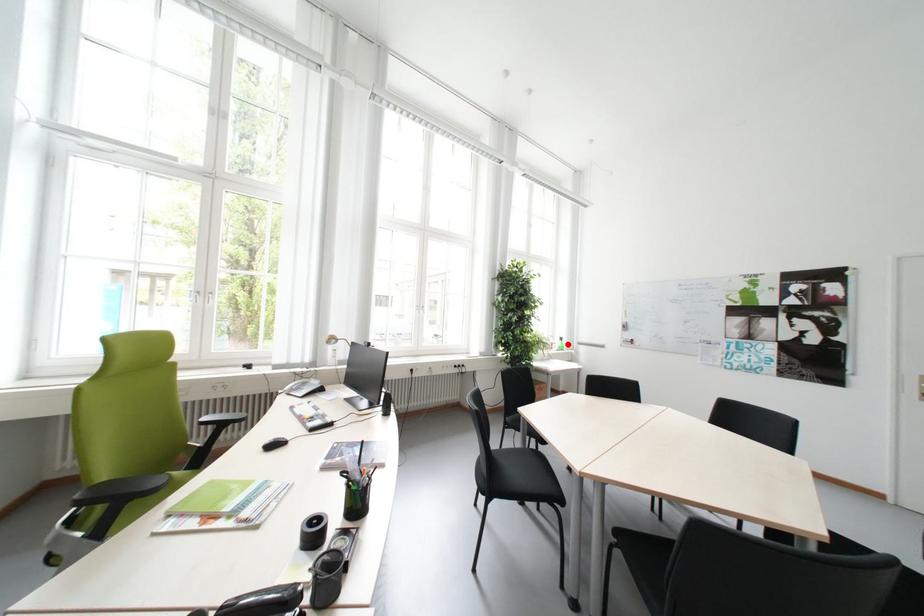
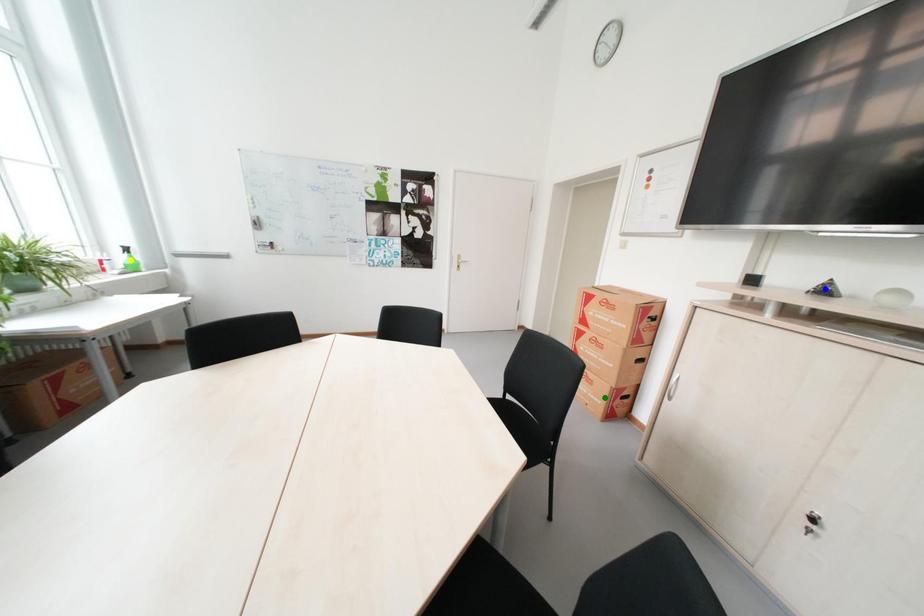
Question: I am providing you with two images of the same scene from different viewpoints. A red point is marked on the first image. You are given multiple points on the second image. Which point in image 2 represents the same 3d spot as the red point in image 1?

Choices:
 (A) green point
 (B) blue point
 (C) yellow point

Answer: (C)